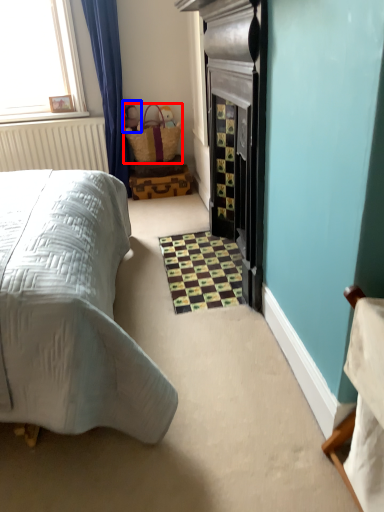
Question: Which object appears closest to the camera in this image, basket (highlighted by a red box) or toy (highlighted by a blue box)?

Choices:
 (A) basket
 (B) toy

Answer: (A)